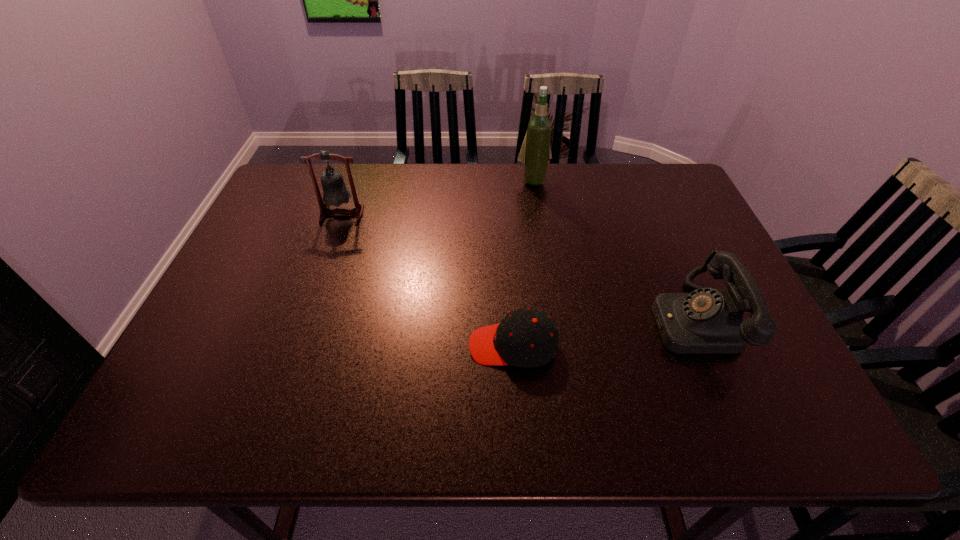
This screenshot has width=960, height=540. I want to click on vacant region at the left edge of the desktop, so click(x=205, y=309).

Identify the location of vacant space at the far left corner of the desktop. The width and height of the screenshot is (960, 540). (321, 165).

Locate an element on the screen. vacant space that's between the farthest object and the leftmost object is located at coordinates (438, 197).

Find the location of a particular element. The height and width of the screenshot is (540, 960). vacant space in between the third tallest object and the shortest object is located at coordinates point(603,333).

I want to click on free space between the wine bottle and the cap, so click(x=523, y=263).

Where is `empty space that is in between the leftmost object and the telephone`? This screenshot has height=540, width=960. empty space that is in between the leftmost object and the telephone is located at coordinates (517, 267).

Identify the location of vacant space that's between the third tallest object and the second tallest object. (517, 267).

You are a GUI agent. You are given a task and a screenshot of the screen. Output one action in this format:
    pyautogui.click(x=<x>, y=<y>)
    Task: Click on the free spot between the cap and the third shortest object
    The height and width of the screenshot is (540, 960).
    Given the screenshot: What is the action you would take?
    pyautogui.click(x=427, y=280)

You are a GUI agent. You are given a task and a screenshot of the screen. Output one action in this format:
    pyautogui.click(x=<x>, y=<y>)
    Task: Click on the free space between the second shortest object and the second farthest object
    The image size is (960, 540).
    Given the screenshot: What is the action you would take?
    pyautogui.click(x=517, y=267)

Locate an element on the screen. This screenshot has width=960, height=540. free space between the second farthest object and the wine bottle is located at coordinates [x=438, y=197].